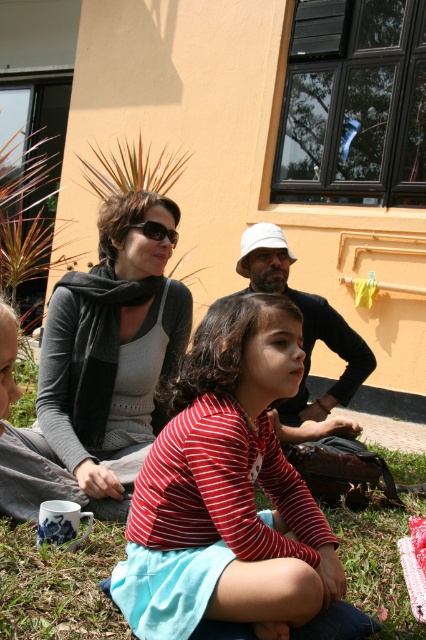
Question: Is matte gray scarf at upper left to the left of green grass at lower center from the viewer's perspective?

Choices:
 (A) yes
 (B) no

Answer: (A)

Question: Does striped cotton shirt at center appear over black plastic sunglasses at center?

Choices:
 (A) no
 (B) yes

Answer: (A)

Question: Which of these objects is positioned farthest from the green grass at lower center?

Choices:
 (A) matte gray scarf at upper left
 (B) matte black shirt at center
 (C) striped cotton shirt at center
 (D) black plastic sunglasses at center

Answer: (D)

Question: Among these points, which one is nearest to the camera?

Choices:
 (A) (230, 321)
 (B) (111, 557)

Answer: (A)

Question: Can you confirm if striped cotton shirt at center is positioned to the left of matte black shirt at center?

Choices:
 (A) yes
 (B) no

Answer: (A)

Question: Which of the following is the closest to the observer?

Choices:
 (A) matte gray scarf at upper left
 (B) black plastic sunglasses at center
 (C) green grass at lower center

Answer: (C)